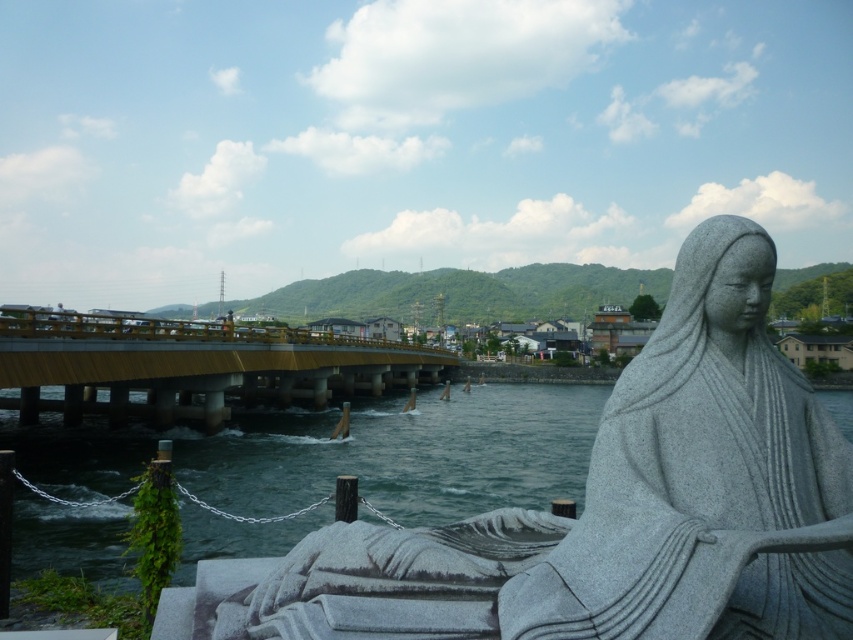
Is granite statue at center to the left of yellow metallic bridge at center from the viewer's perspective?

In fact, granite statue at center is to the right of yellow metallic bridge at center.

What do you see at coordinates (624, 506) in the screenshot?
I see `granite statue at center` at bounding box center [624, 506].

You are a GUI agent. You are given a task and a screenshot of the screen. Output one action in this format:
    pyautogui.click(x=<x>, y=<y>)
    Task: Click on the granite statue at center
    The height and width of the screenshot is (640, 853).
    Given the screenshot: What is the action you would take?
    pyautogui.click(x=624, y=506)

Which is more to the right, granite statue at center or dark blue water at center?

dark blue water at center

Is point (682, 552) behind point (51, 440)?

No, it is not.

Does point (491, 586) come farther from viewer compared to point (384, 401)?

No.

You are a GUI agent. You are given a task and a screenshot of the screen. Output one action in this format:
    pyautogui.click(x=<x>, y=<y>)
    Task: Click on the granite statue at center
    The image size is (853, 640).
    Given the screenshot: What is the action you would take?
    pyautogui.click(x=624, y=506)

Looking at this image, does dark blue water at center have a greater width compared to yellow metallic bridge at center?

Yes, dark blue water at center is wider than yellow metallic bridge at center.

Is point (476, 476) positioned in front of point (201, 371)?

That is True.

The width and height of the screenshot is (853, 640). Identify the location of dark blue water at center. (350, 454).